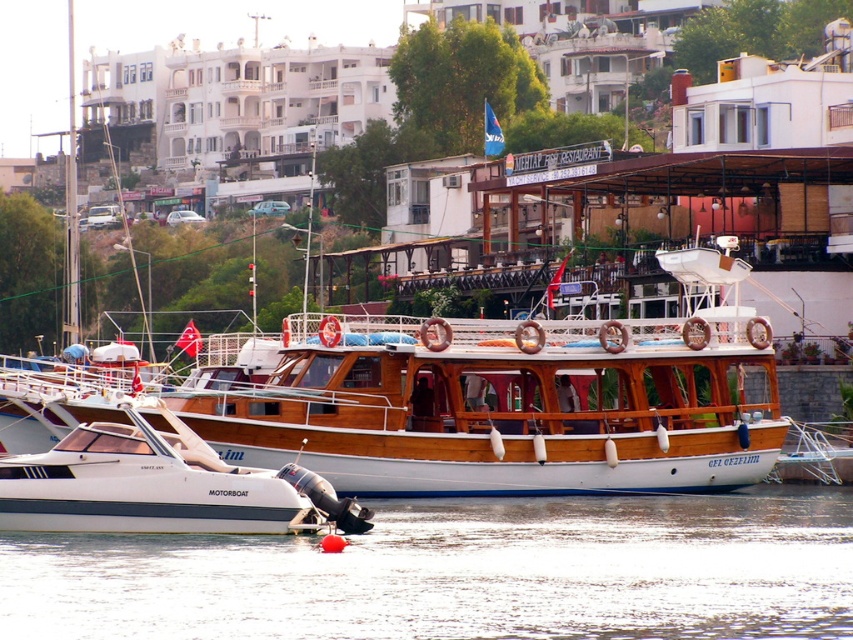
This screenshot has height=640, width=853. What do you see at coordinates (462, 573) in the screenshot?
I see `white smooth water at lower center` at bounding box center [462, 573].

Who is positioned more to the left, white smooth water at lower center or white glossy motorboat at lower left?

white glossy motorboat at lower left is more to the left.

Who is more distant from viewer, (782, 499) or (154, 525)?

The point (782, 499) is more distant.

The width and height of the screenshot is (853, 640). I want to click on white smooth water at lower center, so click(462, 573).